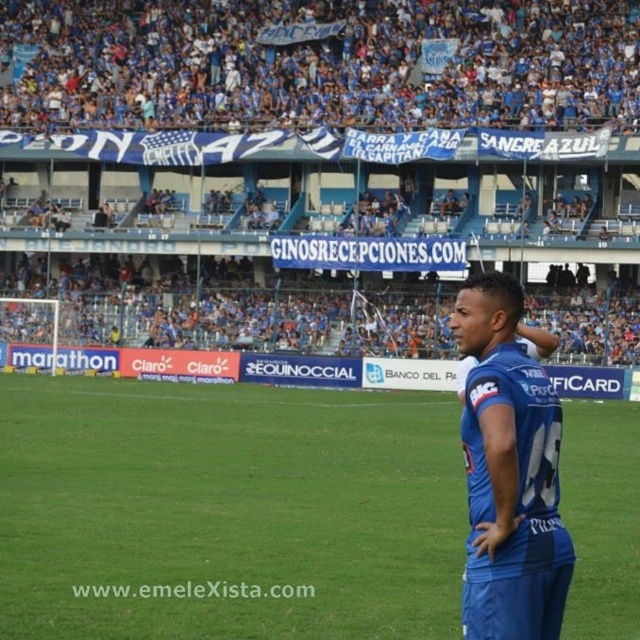
Question: Among these points, which one is farthest from the camera?

Choices:
 (A) 275,554
 (B) 568,566

Answer: (A)

Question: Can you confirm if blue jersey at right is bigger than blue fabric uniform at right?

Choices:
 (A) no
 (B) yes

Answer: (B)

Question: Can you confirm if blue fabric field at center is positioned below blue fabric uniform at right?

Choices:
 (A) yes
 (B) no

Answer: (A)

Question: Which object appears closest to the camera in this image?

Choices:
 (A) blue fabric uniform at right
 (B) blue jersey at right
 (C) blue fabric field at center

Answer: (A)

Question: Is blue fabric field at center bigger than blue fabric uniform at right?

Choices:
 (A) no
 (B) yes

Answer: (B)

Question: Among these points, which one is nearest to the camera?

Choices:
 (A) (522, 410)
 (B) (256, 465)

Answer: (A)